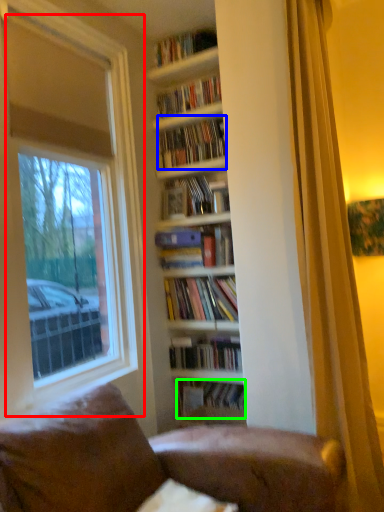
Question: Based on their relative distances, which object is farther from window (highlighted by a red box)? Choose from book (highlighted by a blue box) and book (highlighted by a green box).

Choices:
 (A) book
 (B) book

Answer: (B)